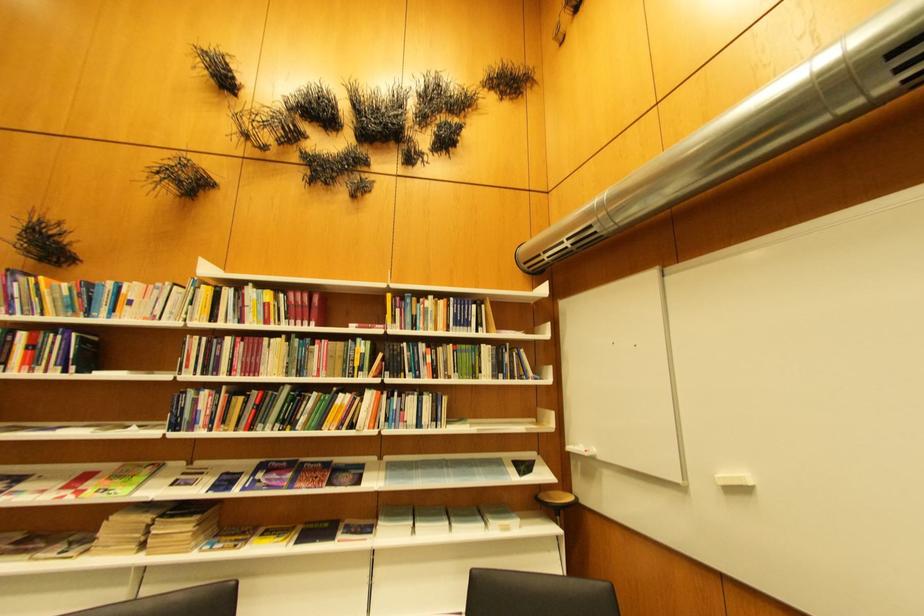
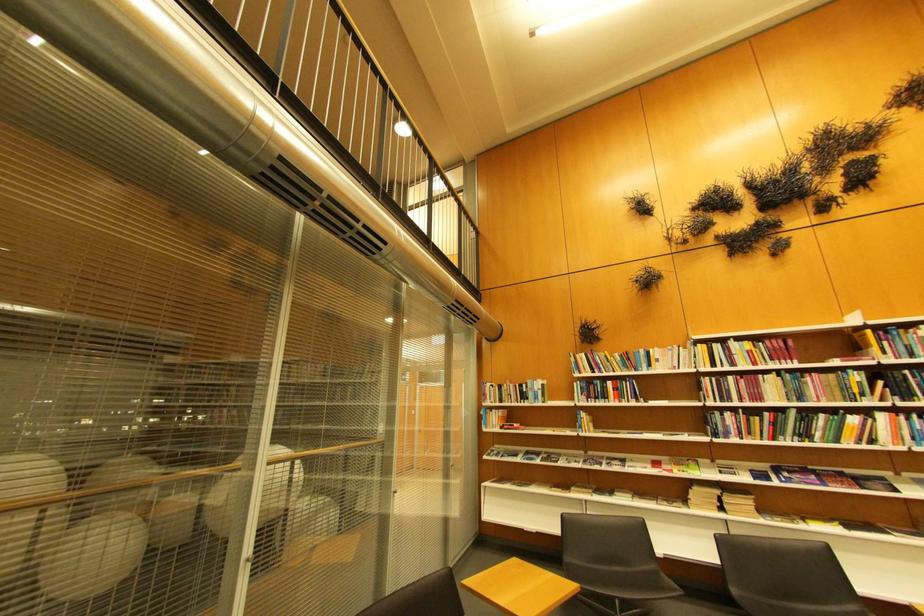
Find the pixel in the second image that matches [330,429] in the first image.

(847, 443)